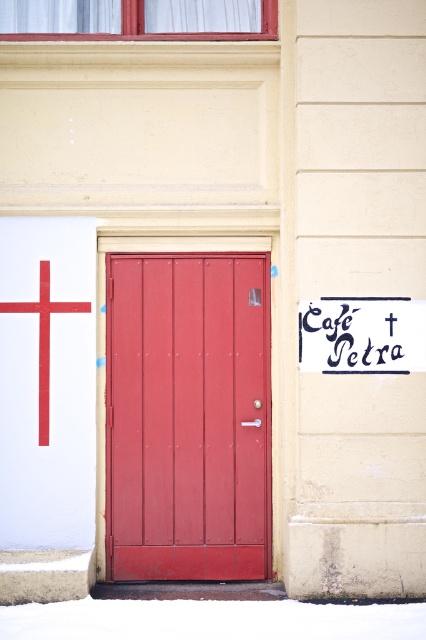
Question: Estimate the real-world distances between objects in this image. Which object is farther from the matte wood door at center?

Choices:
 (A) white paper café petra sign at lower right
 (B) white matte cross at upper left

Answer: (A)

Question: Does matte wood door at center have a greater width compared to white paper café petra sign at lower right?

Choices:
 (A) no
 (B) yes

Answer: (B)

Question: Can you confirm if white paper café petra sign at lower right is bigger than white matte cross at upper left?

Choices:
 (A) no
 (B) yes

Answer: (A)

Question: Which of these objects is positioned farthest from the white paper café petra sign at lower right?

Choices:
 (A) white matte cross at upper left
 (B) matte wood door at center

Answer: (A)

Question: Among these points, which one is farthest from the camera?

Choices:
 (A) (333, 323)
 (B) (14, 301)
 (C) (173, 406)

Answer: (C)

Question: Is matte wood door at center to the right of white matte cross at upper left from the viewer's perspective?

Choices:
 (A) no
 (B) yes

Answer: (B)